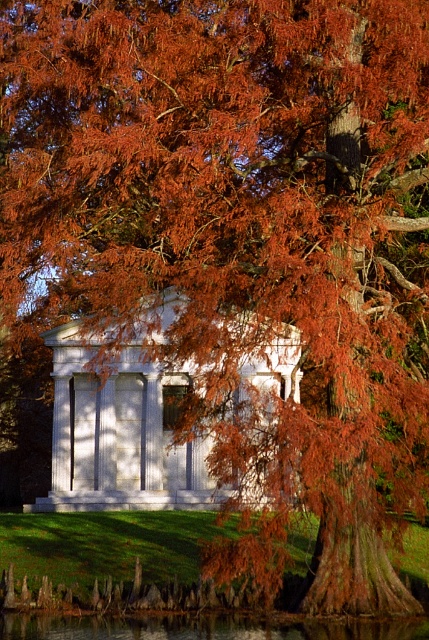
You are planning to host a small gathering in the white marble gazebo at center. Considering the size of the transparent water at lower center, do you think it will be a problem if some guests accidentally step into the water?

The white marble gazebo at center is larger than the transparent water at lower center, so the water area is smaller. Therefore, it is unlikely to be a problem if some guests accidentally step into the water as the area is limited.

You are a visitor at a garden and want to take a photo of the white marble gazebo at center without the transparent water at lower center appearing in the shot. How can you adjust your position to achieve this?

Move your position so that you are standing behind the white marble gazebo at center, as it is positioned over the transparent water at lower center and will block the view of the water when framed properly.